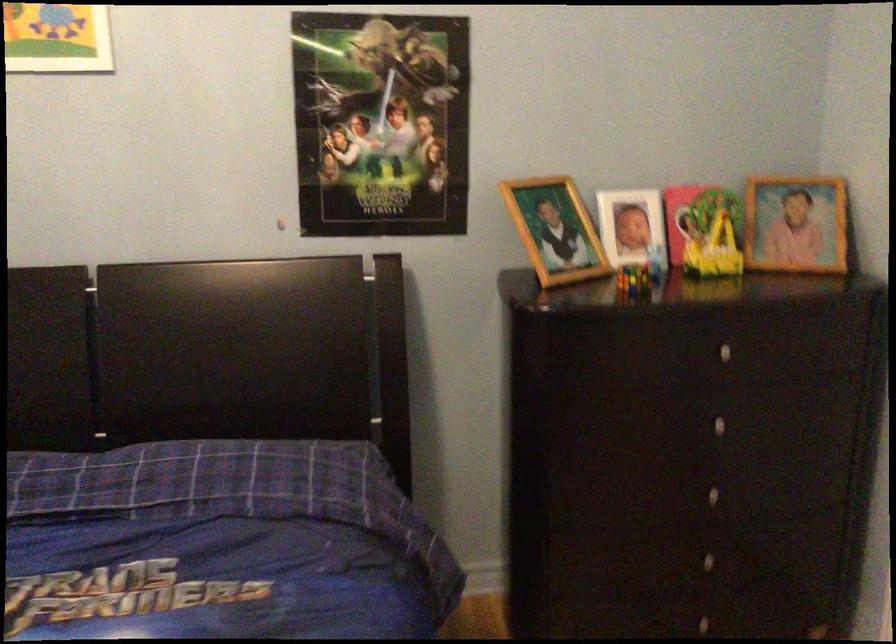
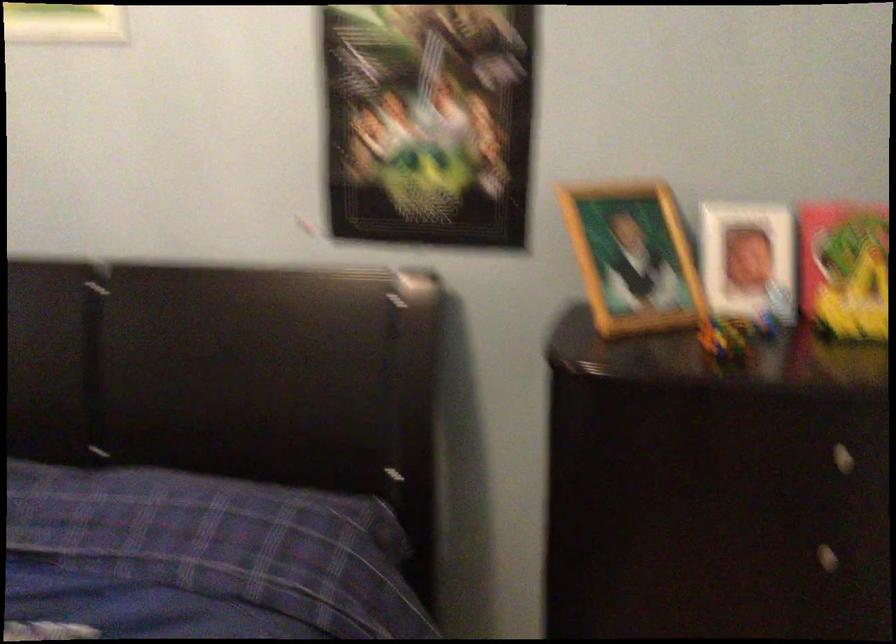
Where in the second image is the point corresponding to pixel 556 230 from the first image?

(633, 258)